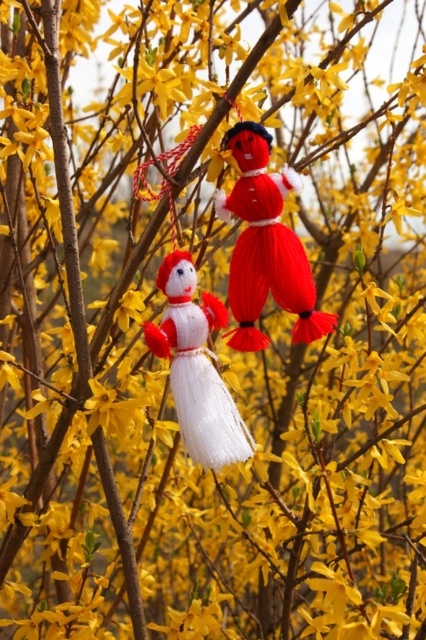
You are a bird perched on a branch looking down at the knitted woolen doll at center and the white yarn snowman at center. Which doll is closer to the ground?

The white yarn snowman at center is closer to the ground because the knitted woolen doll at center is located above it.

You are a child who wants to give both the knitted woolen doll at center and the white yarn snowman at center to your friend. The box you have can only fit items that are 3 inches apart. Can both items fit in the box together?

The knitted woolen doll at center and the white yarn snowman at center are 2.73 inches apart, so they can fit in the box since the distance between them is less than 3 inches.

You are a child trying to hang both the knitted woolen doll at center and the white yarn snowman at center on a tree branch that can only hold one of them. Based on their widths, which doll should you choose to hang?

The knitted woolen doll at center might be wider than the white yarn snowman at center, so you should choose the white yarn snowman at center to hang since it is narrower and less likely to cause the branch to break.